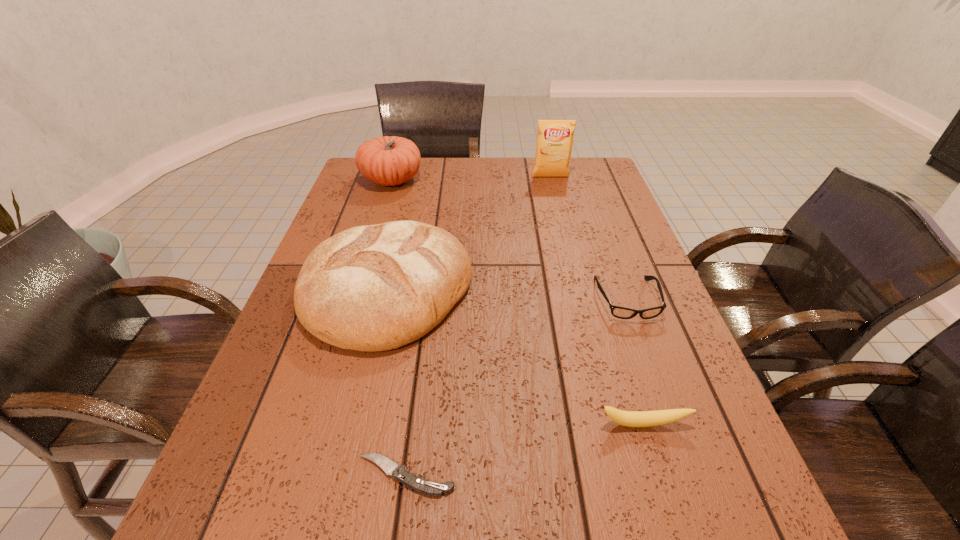
Locate an element on the screen. the tallest object is located at coordinates (555, 137).

Where is `pumpkin`? pumpkin is located at coordinates (390, 160).

Image resolution: width=960 pixels, height=540 pixels. I want to click on bread, so click(370, 288).

Identify the location of the fourth tallest object. (637, 419).

Locate an element on the screen. Image resolution: width=960 pixels, height=540 pixels. banana is located at coordinates (637, 419).

Identify the location of the fifth tallest object. The width and height of the screenshot is (960, 540). (619, 312).

Locate an element on the screen. This screenshot has height=540, width=960. pocketknife is located at coordinates (420, 484).

Locate an element on the screen. This screenshot has width=960, height=540. the shortest object is located at coordinates (420, 484).

This screenshot has height=540, width=960. In order to click on vacant space situated on the front of the crisp (potato chip) with the logo in this screenshot , I will do `click(567, 244)`.

This screenshot has width=960, height=540. Find the location of `free space located 0.380m on the right of the pumpkin`. free space located 0.380m on the right of the pumpkin is located at coordinates point(535,180).